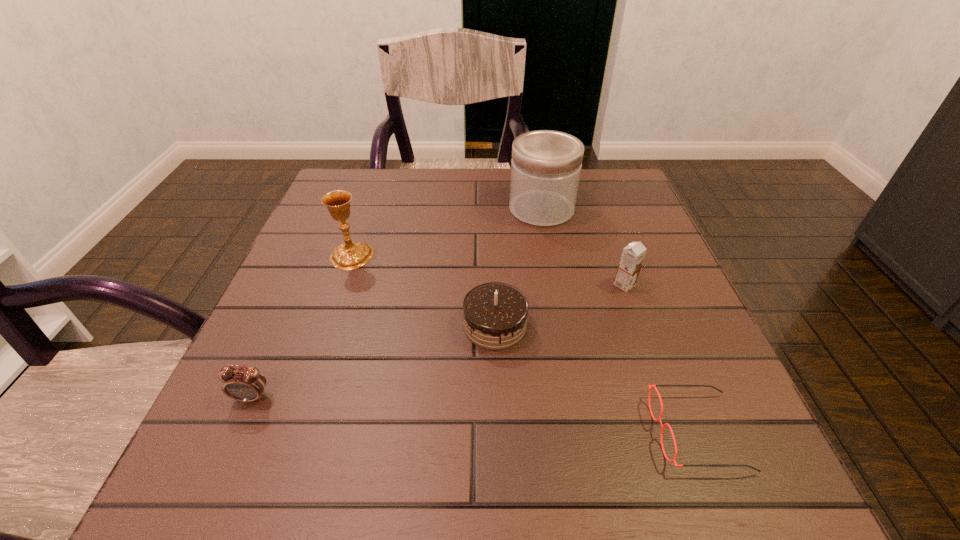
Where is `spectacles located at the right edge`? Image resolution: width=960 pixels, height=540 pixels. spectacles located at the right edge is located at coordinates (650, 388).

Where is `object that is at the near right corner`? object that is at the near right corner is located at coordinates (650, 388).

Image resolution: width=960 pixels, height=540 pixels. In the image, there is a desktop. Find the location of `vacant space at the far edge`. vacant space at the far edge is located at coordinates (460, 198).

Where is `free space at the near edge of the desktop`? This screenshot has height=540, width=960. free space at the near edge of the desktop is located at coordinates (569, 468).

Identify the location of vacant space at the right edge of the desktop. The width and height of the screenshot is (960, 540). (651, 281).

Identify the location of vacant space at the far left corner. (374, 174).

Locate an element on the screen. free space at the far right corner of the desktop is located at coordinates (629, 204).

Locate an element on the screen. Image resolution: width=960 pixels, height=540 pixels. free space between the farthest object and the chalice is located at coordinates (446, 233).

Where is `unoccupied position between the third nearest object and the chocolate milk`? This screenshot has height=540, width=960. unoccupied position between the third nearest object and the chocolate milk is located at coordinates (560, 305).

Locate an element on the screen. vacant space that is in between the third nearest object and the leftmost object is located at coordinates (373, 361).